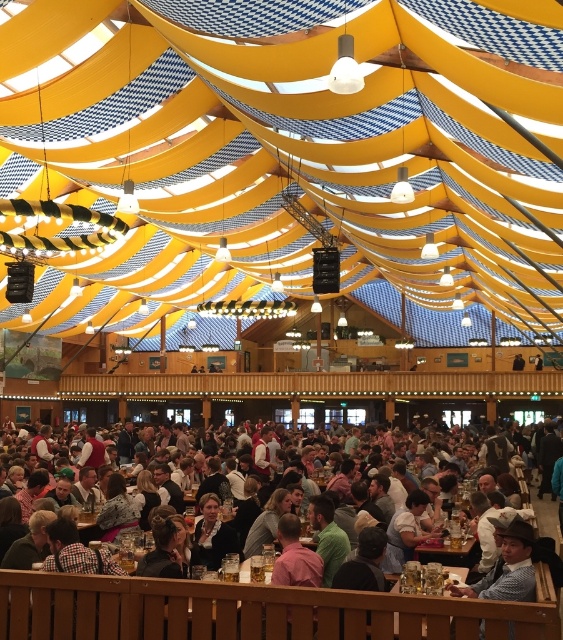
You are a photographer at the event and want to capture a photo of both the white shirt at center and the wooden table at lower center in the same frame. Considering their sizes, which object should you focus on first to ensure both are clearly visible in the photo?

Since the white shirt at center is smaller than the wooden table at lower center, you should focus on the white shirt at center first to ensure its details are sharp while the larger wooden table at lower center will remain in focus more easily.